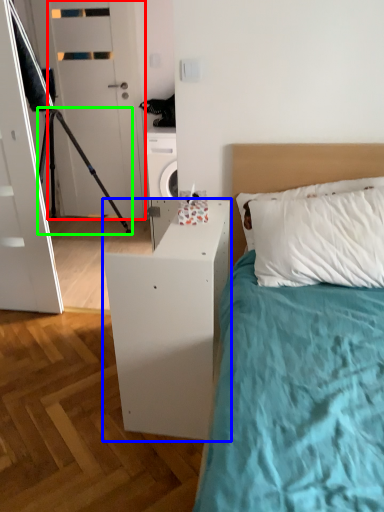
Question: Estimate the real-world distances between objects in this image. Which object is closer to door (highlighted by a red box), nightstand (highlighted by a blue box) or tripod (highlighted by a green box)?

Choices:
 (A) nightstand
 (B) tripod

Answer: (B)